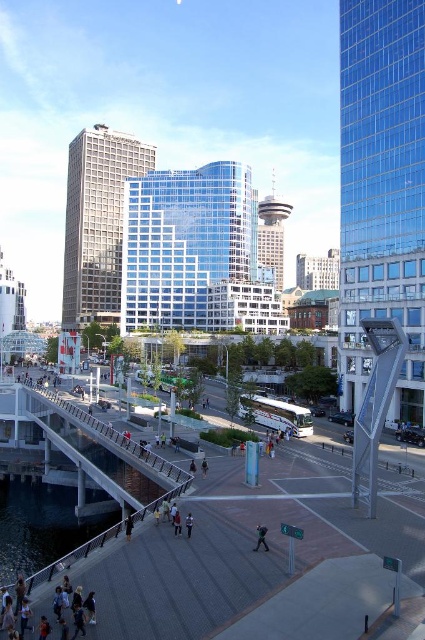
You are a photographer standing on the plaza and want to take a photo of the glassy steel tower at center and the black fabric coat at lower center. Which object should you focus on first to ensure it appears sharp in the photo?

You should focus on the glassy steel tower at center first because it is closer to you than the black fabric coat at lower center, so it will be in focus before the background object.

You are a drone operator who needs to fly a drone from the transparent glass building at center to the concrete gray pedestrian bridge at lower left. Considering their heights, will the drone need to ascend or descend during the flight?

The transparent glass building at center has a greater height compared to the concrete gray pedestrian bridge at lower left, so the drone will need to descend during the flight.

You are standing at point (382, 189) in the plaza. What can you see at this location?

At point (382, 189), there is a transparent glass tower at right.